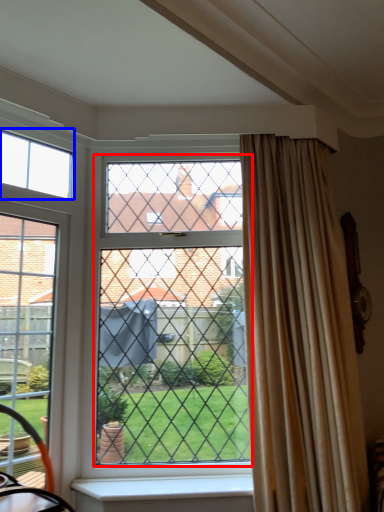
Question: Which of the following is the closest to the observer, glass window (highlighted by a red box) or window (highlighted by a blue box)?

Choices:
 (A) glass window
 (B) window

Answer: (A)